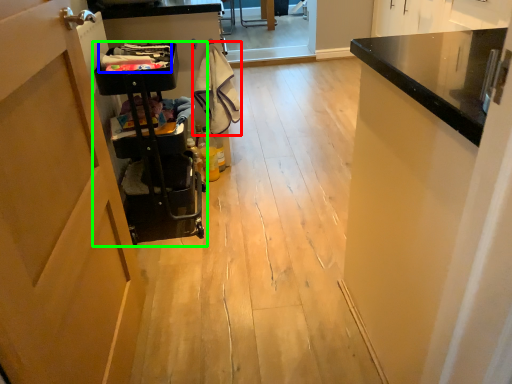
Question: Which object is positioned farthest from laundry (highlighted by a red box)? Select from laundry (highlighted by a blue box) and trolley (highlighted by a green box).

Choices:
 (A) laundry
 (B) trolley

Answer: (B)